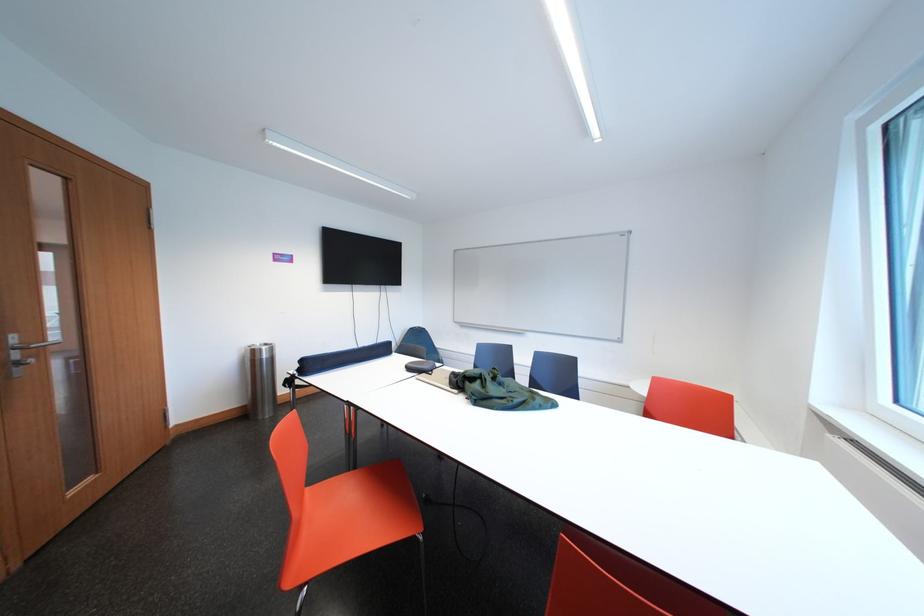
Where would you sit the red chair sitting surface? Please return your answer as a coordinate pair (x, y).

(657, 588)